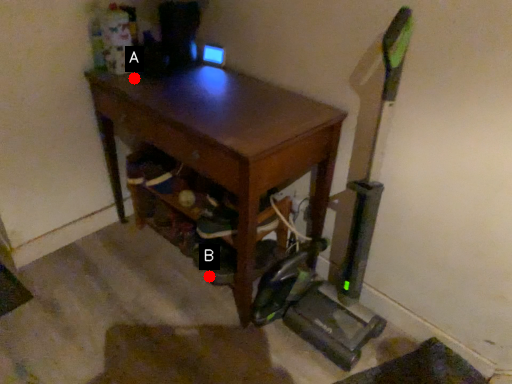
Question: Two points are circled on the image, labeled by A and B beside each circle. Which of the following is the farthest from the observer?

Choices:
 (A) A is further
 (B) B is further

Answer: (B)